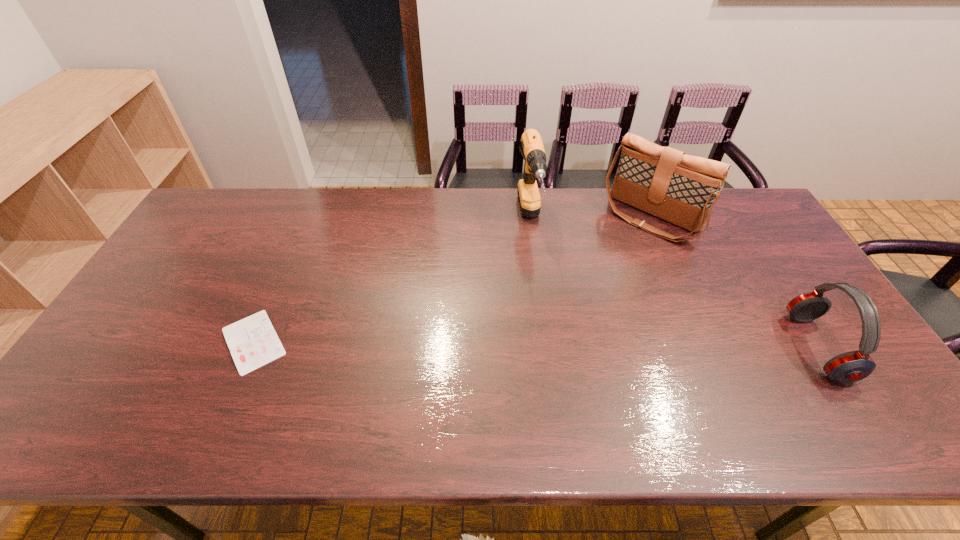
The width and height of the screenshot is (960, 540). What are the coordinates of `vacant space on the desktop that is between the leftmost object and the earphone and is positioned at the tip of the third object from right to left` in the screenshot? It's located at (556, 345).

Identify the location of vacant space on the desktop that is between the diary and the second shortest object and is positioned on the front-facing side of the shoulder bag. The image size is (960, 540). (534, 344).